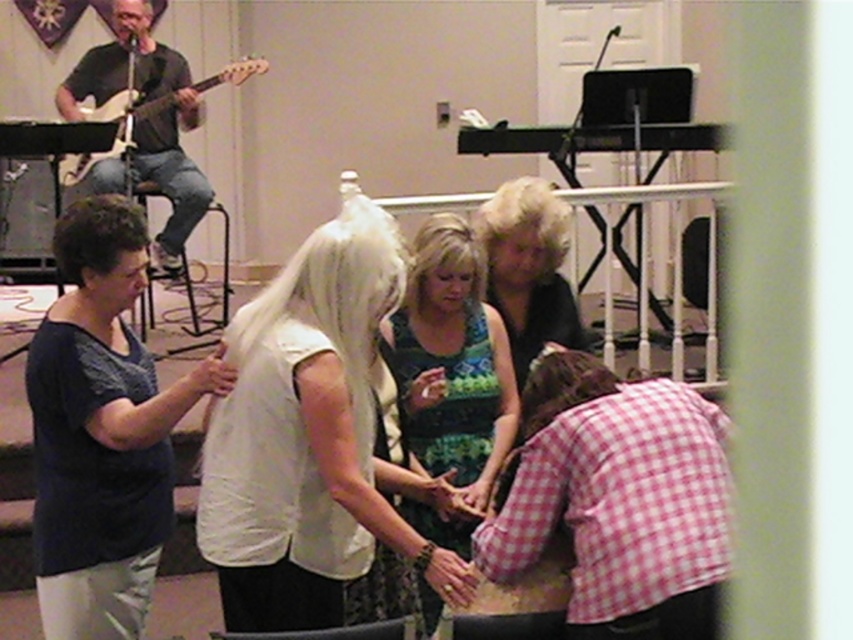
Is dark blue fabric shirt at left taller than matte electric guitar at upper left?

Correct, dark blue fabric shirt at left is much taller as matte electric guitar at upper left.

Does point (157, 557) lie behind point (158, 108)?

No.

Describe the element at coordinates (102, 429) in the screenshot. Image resolution: width=853 pixels, height=640 pixels. I see `dark blue fabric shirt at left` at that location.

You are a GUI agent. You are given a task and a screenshot of the screen. Output one action in this format:
    pyautogui.click(x=<x>, y=<y>)
    Task: Click on the dark blue fabric shirt at left
    This screenshot has width=853, height=640.
    Given the screenshot: What is the action you would take?
    pyautogui.click(x=102, y=429)

Who is positioned more to the right, white matte veil at center or pink checkered shirt at lower right?

Positioned to the right is pink checkered shirt at lower right.

Can you confirm if white matte veil at center is wider than pink checkered shirt at lower right?

Yes.

Where is `white matte veil at center`? The image size is (853, 640). white matte veil at center is located at coordinates (309, 436).

Does point (91, 468) come behind point (511, 356)?

No, it is in front of (511, 356).

Which is in front, point (90, 621) or point (532, 300)?

Point (90, 621) is more forward.

Who is more distant from viewer, [96,289] or [532,339]?

The point [532,339] is behind.

Image resolution: width=853 pixels, height=640 pixels. Find the location of `dark blue fabric shirt at left`. dark blue fabric shirt at left is located at coordinates (102, 429).